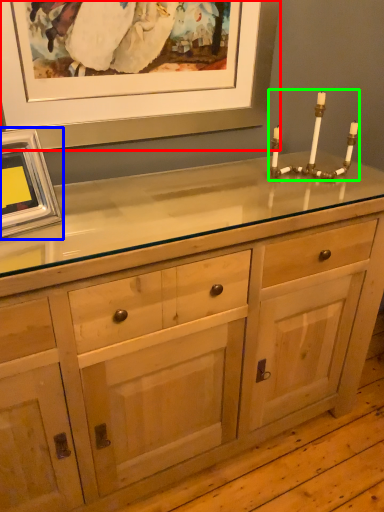
Question: Considering the real-world distances, which object is closest to picture frame (highlighted by a red box)? picture frame (highlighted by a blue box) or candle holder (highlighted by a green box).

Choices:
 (A) picture frame
 (B) candle holder

Answer: (B)